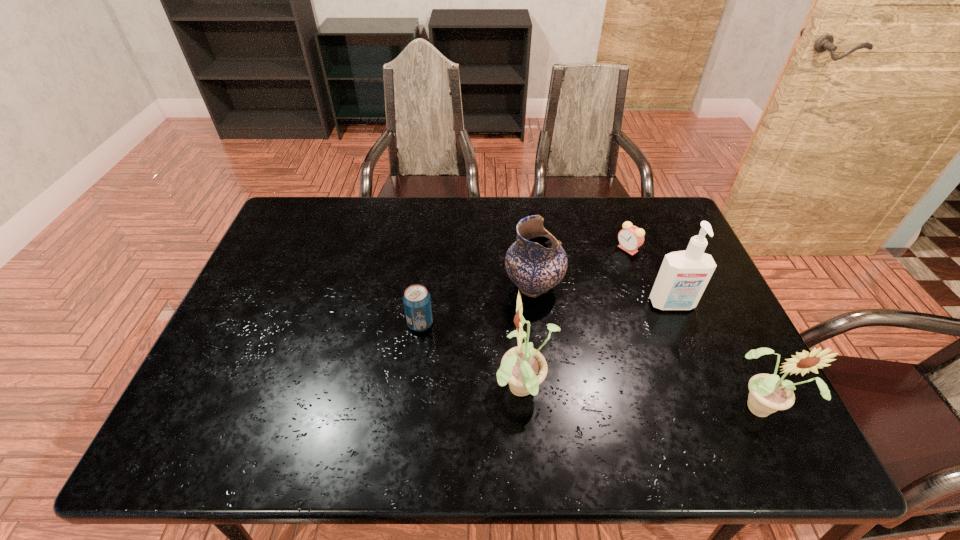
This screenshot has height=540, width=960. In the image, there is a desktop. What are the coordinates of `vacant space at the far edge` in the screenshot? It's located at (529, 203).

Where is `vacant space at the near edge of the desktop`? Image resolution: width=960 pixels, height=540 pixels. vacant space at the near edge of the desktop is located at coordinates (417, 406).

Locate an element on the screen. free space at the left edge of the desktop is located at coordinates (245, 312).

This screenshot has height=540, width=960. I want to click on vacant point at the far left corner, so click(336, 197).

Identify the location of vacant area that lies between the third shortest object and the right sunflower. This screenshot has height=540, width=960. (647, 346).

Locate an element on the screen. The image size is (960, 540). free space that is in between the right sunflower and the pottery is located at coordinates [647, 346].

Find the location of a particular element. empty space that is in between the fourth tallest object and the shortest object is located at coordinates (581, 268).

The image size is (960, 540). In order to click on vacant point located between the pop soda and the taller sunflower in this screenshot , I will do `click(472, 357)`.

Where is `vacant region between the cleansing agent and the third shortest object`? vacant region between the cleansing agent and the third shortest object is located at coordinates (603, 296).

The width and height of the screenshot is (960, 540). Find the location of `free space between the cleansing agent and the shortest object`. free space between the cleansing agent and the shortest object is located at coordinates (650, 277).